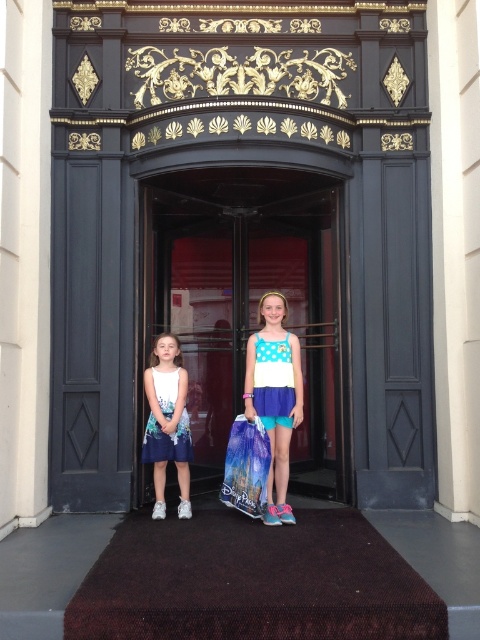
Question: Which object appears closest to the camera in this image?

Choices:
 (A) polka dot dress at center
 (B) transparent plastic bag at center
 (C) white polka dot dress at center
 (D) black glossy elevator at center

Answer: (A)

Question: Among these points, which one is farthest from the camera?

Choices:
 (A) (164, 499)
 (B) (193, 19)

Answer: (B)

Question: Does brown textured doormat at center appear under white polka dot dress at center?

Choices:
 (A) no
 (B) yes

Answer: (B)

Question: Is black glossy elevator at center wider than transparent plastic bag at center?

Choices:
 (A) no
 (B) yes

Answer: (B)

Question: Does polka dot dress at center appear over white polka dot dress at center?

Choices:
 (A) no
 (B) yes

Answer: (B)

Question: Which object is positioned farthest from the white polka dot dress at center?

Choices:
 (A) brown textured doormat at center
 (B) black glossy elevator at center
 (C) polka dot dress at center

Answer: (B)